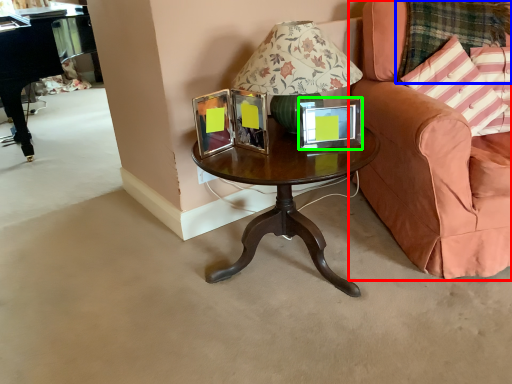
Question: Estimate the real-world distances between objects in this image. Which object is farther from chair (highlighted by a red box), plaid (highlighted by a blue box) or picture frame (highlighted by a green box)?

Choices:
 (A) plaid
 (B) picture frame

Answer: (B)